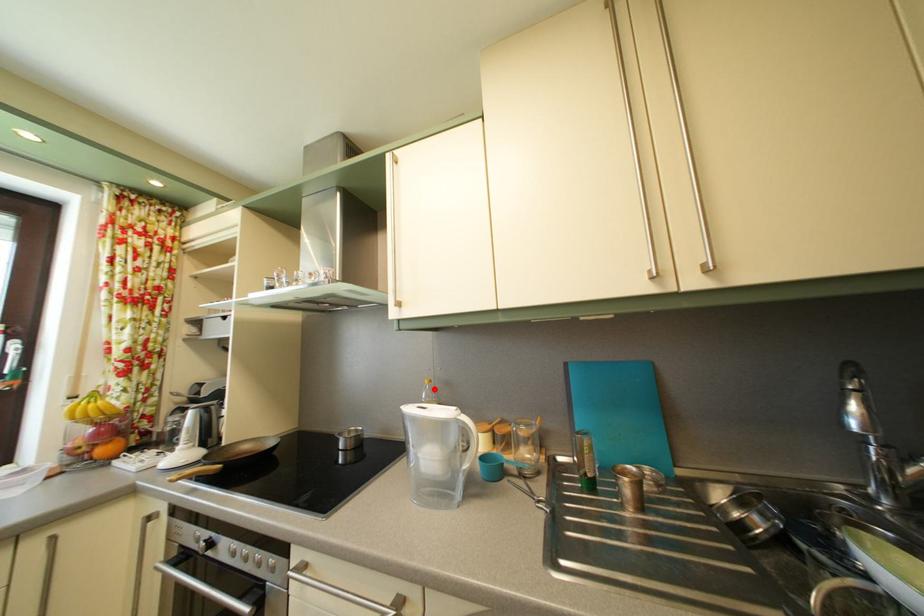
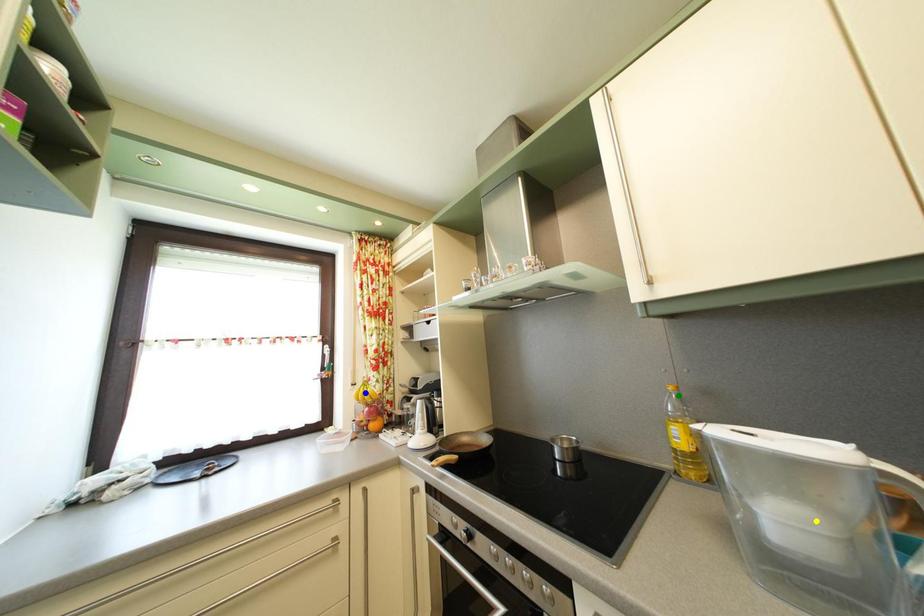
Question: I am providing you with two images of the same scene from different viewpoints. A red point is marked on the first image. You are given multiple points on the second image. Which spot in image 2 lines up with the point in image 1?

Choices:
 (A) green point
 (B) blue point
 (C) yellow point

Answer: (A)